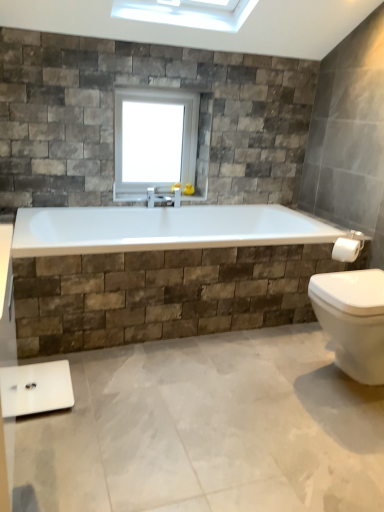
Question: Is the depth of white glass window at upper center greater than that of white glossy scale at lower left?

Choices:
 (A) yes
 (B) no

Answer: (A)

Question: From the image's perspective, is white glass window at upper center located beneath white glossy scale at lower left?

Choices:
 (A) yes
 (B) no

Answer: (B)

Question: From the image's perspective, is white glass window at upper center on white glossy scale at lower left?

Choices:
 (A) no
 (B) yes

Answer: (B)

Question: Are white glass window at upper center and white glossy scale at lower left making contact?

Choices:
 (A) yes
 (B) no

Answer: (B)

Question: Can white glossy scale at lower left be found inside white glass window at upper center?

Choices:
 (A) no
 (B) yes

Answer: (A)

Question: From the image's perspective, is white glass window at upper center above or below white glossy towel bar at right?

Choices:
 (A) above
 (B) below

Answer: (A)

Question: Based on their positions, is white glass window at upper center located to the left or right of white glossy towel bar at right?

Choices:
 (A) left
 (B) right

Answer: (A)

Question: Is white glass window at upper center wider or thinner than white glossy towel bar at right?

Choices:
 (A) thin
 (B) wide

Answer: (A)

Question: From a real-world perspective, is white glass window at upper center positioned above or below white glossy towel bar at right?

Choices:
 (A) below
 (B) above

Answer: (B)

Question: Choose the correct answer: Is white glossy towel bar at right inside white glossy scale at lower left or outside it?

Choices:
 (A) outside
 (B) inside

Answer: (A)

Question: In the image, is white glossy towel bar at right positioned in front of or behind white glossy scale at lower left?

Choices:
 (A) front
 (B) behind

Answer: (B)

Question: Is white glossy towel bar at right taller or shorter than white glossy scale at lower left?

Choices:
 (A) tall
 (B) short

Answer: (A)

Question: Considering the positions of point (347, 239) and point (11, 412), is point (347, 239) closer or farther from the camera than point (11, 412)?

Choices:
 (A) farther
 (B) closer

Answer: (A)

Question: Considering their positions, is white glossy scale at lower left located in front of or behind white glossy towel bar at right?

Choices:
 (A) behind
 (B) front

Answer: (B)

Question: Considering the relative positions of white glossy scale at lower left and white glossy towel bar at right in the image provided, is white glossy scale at lower left to the left or to the right of white glossy towel bar at right?

Choices:
 (A) right
 (B) left

Answer: (B)